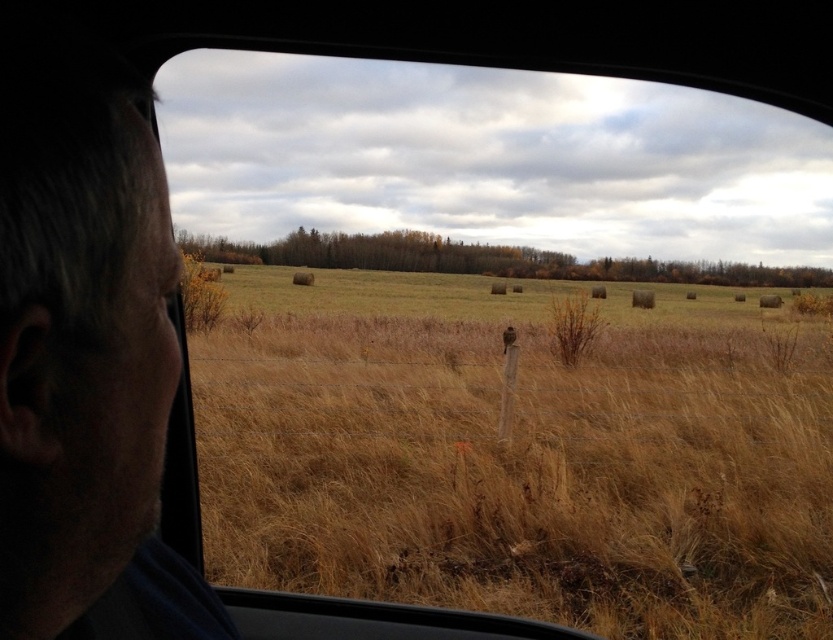
You are sitting in the back seat of the car and notice two points outside through the rear window. The first point is at coordinate [707,516] and the second is at [101,88]. Which point is closer to the car?

Point [101,88] is closer to the car because it is in front of point [707,516], which is further away.

You are sitting in the back seat of a car and looking out the rear window. You see dry grass at center and gray hair at left. Which object is closer to you?

The dry grass at center is closer to you because it is further to the viewer than gray hair at left.